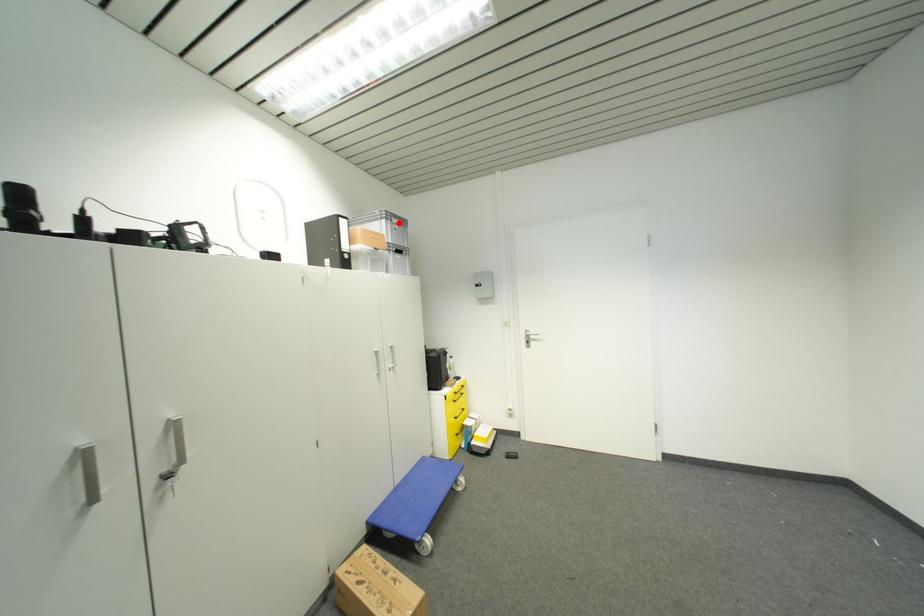
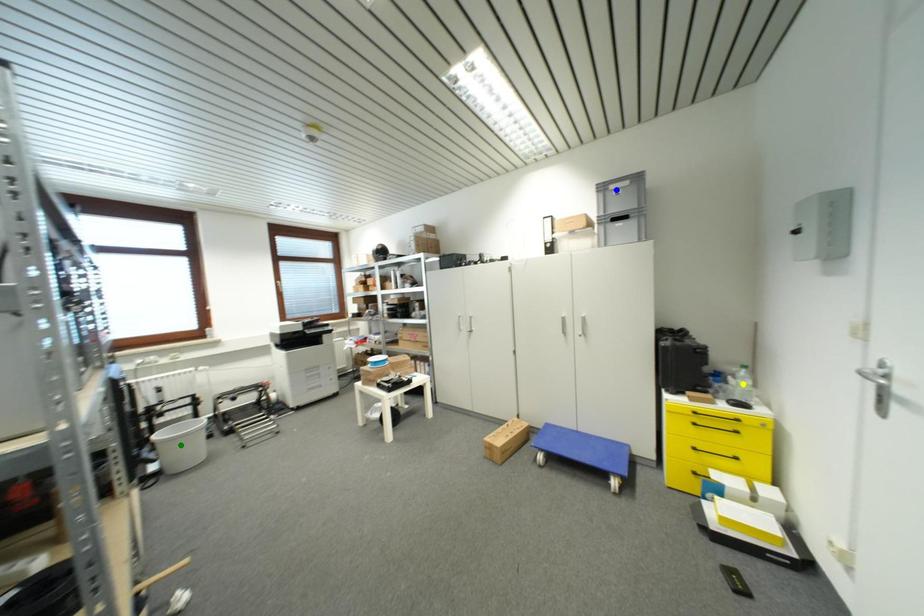
Question: I am providing you with two images of the same scene from different viewpoints. A red point is marked on the first image. You are given multiple points on the second image. Which point in image 2 is actually the same real-world point as the red point in image 1?

Choices:
 (A) green point
 (B) yellow point
 (C) blue point

Answer: (C)